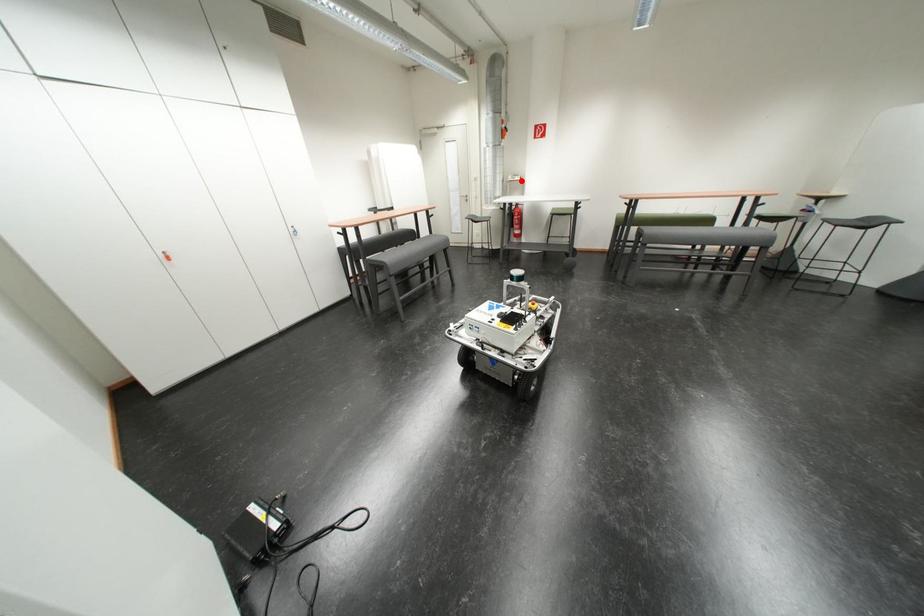
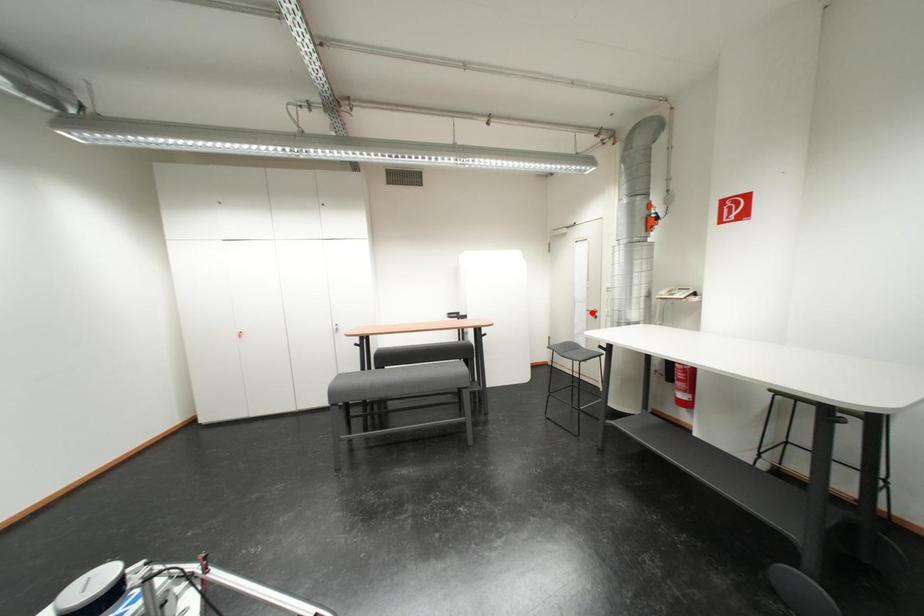
I am providing you with two images of the same scene from different viewpoints. A red point is marked on the first image and another point is marked on the second image. Does the point marked in image1 correspond to the same location as the one in image2?

No